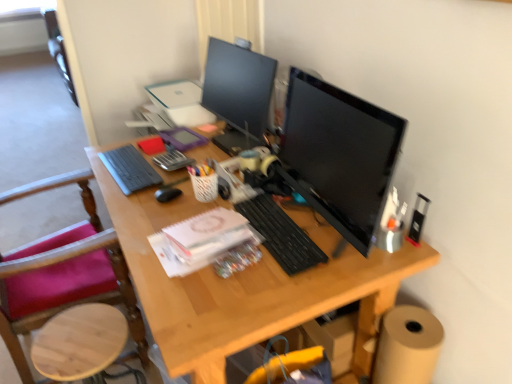
Question: Is point (419, 231) positioned closer to the camera than point (238, 148)?

Choices:
 (A) farther
 (B) closer

Answer: (B)

Question: From a real-world perspective, relative to matte black monitor at upper center, which appears as the second computer monitor when viewed from the front, is metallic black stapler at right, the first stationery positioned from the bottom, vertically above or below?

Choices:
 (A) above
 (B) below

Answer: (B)

Question: Estimate the real-world distances between objects in this image. Which object is farther from the black matte mouse at center?

Choices:
 (A) matte black monitor at upper center, which appears as the second computer monitor when viewed from the front
 (B) black matte keyboard at center, arranged as the second computer keyboard when viewed from the left
 (C) gray matte keyboard at left, arranged as the second computer keyboard when ordered from the bottom
 (D) metallic black stapler at right, which appears as the second stationery when viewed from the top
 (E) translucent plastic pen holder at center, acting as the first stationery starting from the top

Answer: (D)

Question: Which is nearer to the gray matte keyboard at left, the second computer keyboard positioned from the front?

Choices:
 (A) black matte keyboard at center, which is counted as the second computer keyboard, starting from the top
 (B) black glossy monitor at center, the 2th computer monitor positioned from the back
 (C) matte black monitor at upper center, which is the first computer monitor in back-to-front order
 (D) translucent plastic pen holder at center, the second stationery positioned from the bottom
 (E) wooden chair at left

Answer: (D)